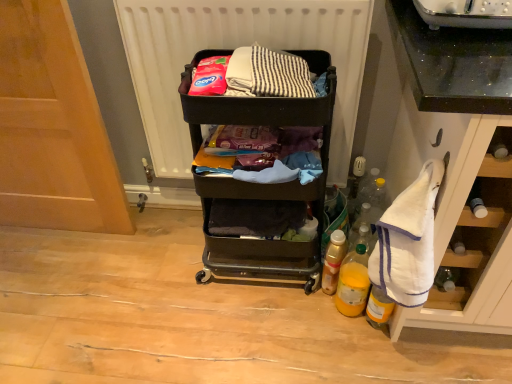
Identify the location of free space to the left of black plastic cart at center. The height and width of the screenshot is (384, 512). (164, 275).